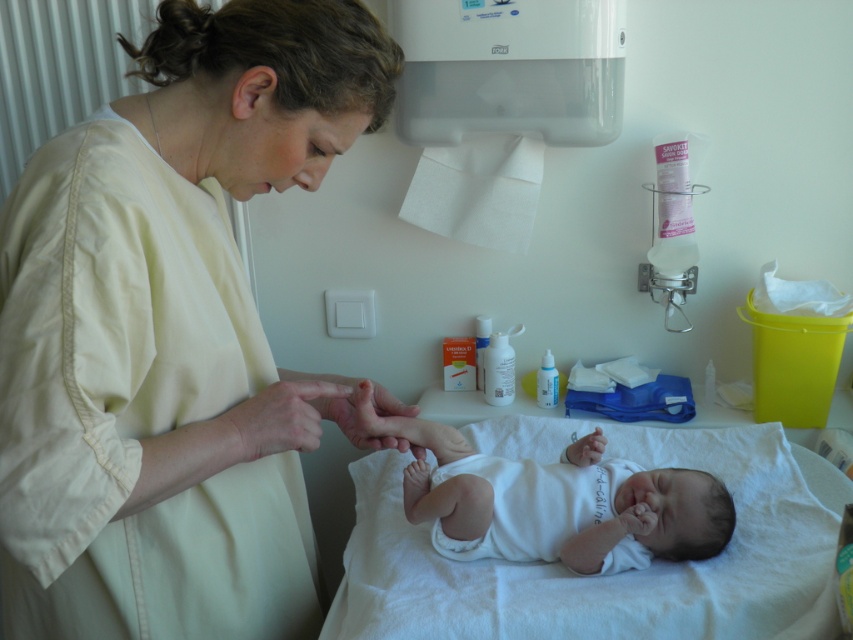
Which is below, white soft hospital bed at center or white cotton newborn at center?

white soft hospital bed at center is below.

Can you confirm if white soft hospital bed at center is thinner than white cotton newborn at center?

No.

Is point (817, 614) positioned before point (390, 422)?

That is True.

Identify the location of white soft hospital bed at center. Image resolution: width=853 pixels, height=640 pixels. (604, 577).

Which is behind, point (683, 456) or point (329, 404)?

Positioned behind is point (683, 456).

Is white soft hospital bed at center wider than smooth skin hand at center?

Yes, white soft hospital bed at center is wider than smooth skin hand at center.

Is point (514, 456) more distant than point (409, 412)?

Yes.

Identify the location of white soft hospital bed at center. (604, 577).

How distant is matte white gown at center from white cotton newborn at center?

A distance of 13.74 inches exists between matte white gown at center and white cotton newborn at center.

What do you see at coordinates (170, 333) in the screenshot? I see `matte white gown at center` at bounding box center [170, 333].

Where is `matte white gown at center`? This screenshot has height=640, width=853. matte white gown at center is located at coordinates (170, 333).